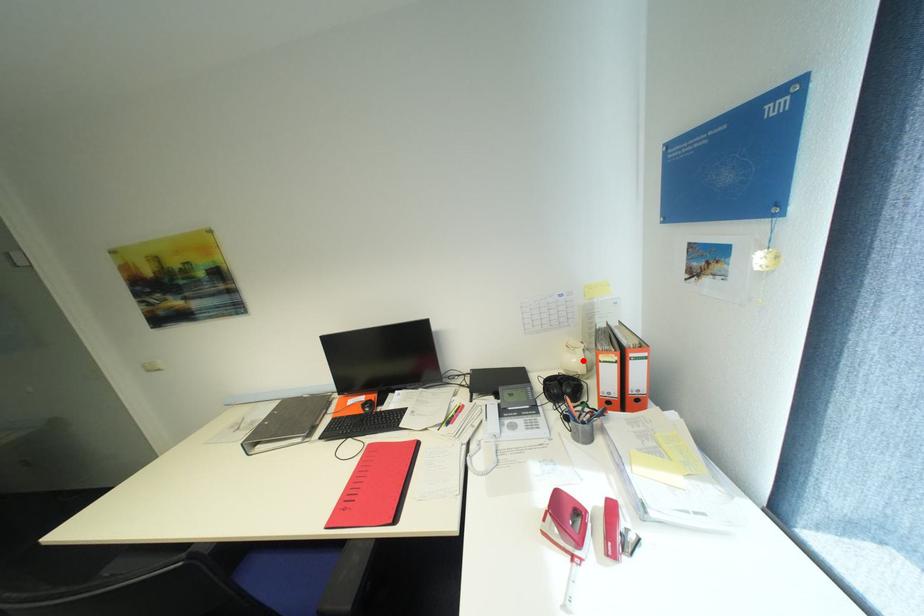
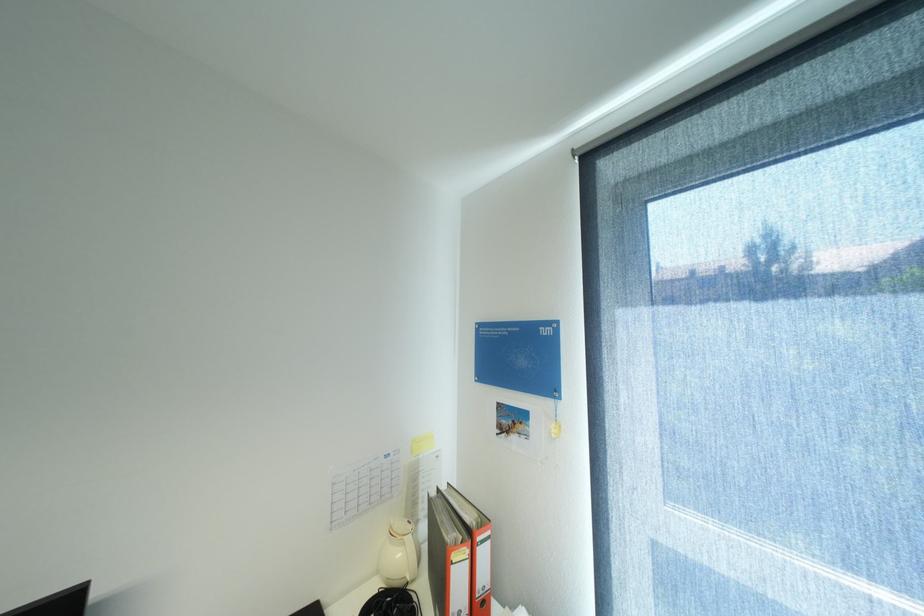
In the second image, find the point that corresponds to the highlighted location in the first image.

(407, 554)